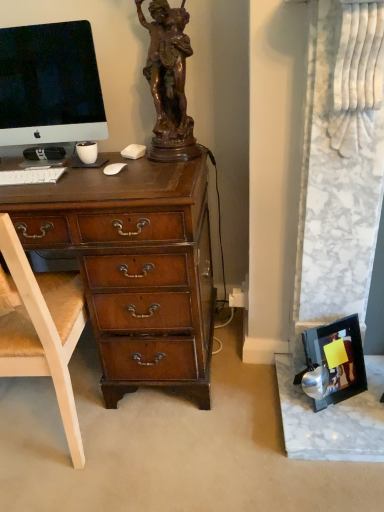
Question: Based on their sizes in the image, would you say satin black monitor at upper left is bigger or smaller than white plastic power outlet at lower center?

Choices:
 (A) small
 (B) big

Answer: (B)

Question: Considering their positions, is satin black monitor at upper left located in front of or behind white plastic power outlet at lower center?

Choices:
 (A) behind
 (B) front

Answer: (B)

Question: Which is nearer to the white wood chair at left?

Choices:
 (A) metallic silver picture frame at lower right
 (B) white matte keyboard at left
 (C) white plastic power outlet at lower center
 (D) satin black monitor at upper left

Answer: (B)

Question: Estimate the real-world distances between objects in this image. Which object is closer to the white wood chair at left?

Choices:
 (A) metallic silver picture frame at lower right
 (B) white matte keyboard at left
 (C) satin black monitor at upper left
 (D) white plastic power outlet at lower center

Answer: (B)